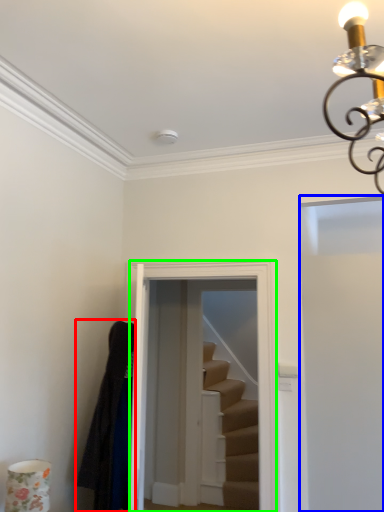
Question: Estimate the real-world distances between objects in this image. Which object is closer to robe (highlighted by a red box), door (highlighted by a blue box) or glass door (highlighted by a green box)?

Choices:
 (A) door
 (B) glass door

Answer: (B)